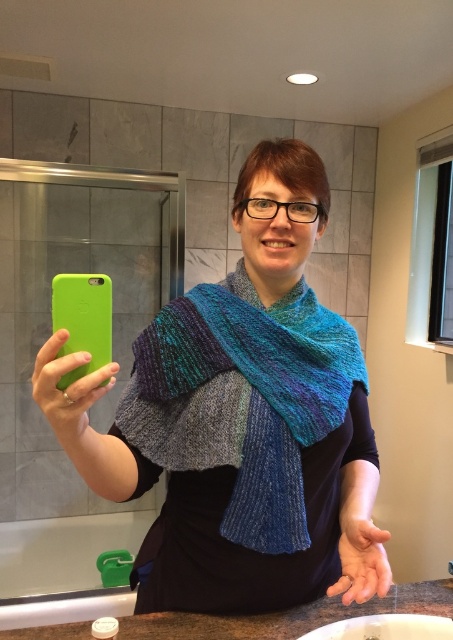
Question: Among these points, which one is farthest from the camera?

Choices:
 (A) (390, 609)
 (B) (136, 406)
 (C) (102, 326)
 (D) (73, 429)

Answer: (A)

Question: Is granite countertop at lower center wider than green matte phone at left?

Choices:
 (A) no
 (B) yes

Answer: (B)

Question: Can you confirm if knitted wool scarf at center is thinner than granite countertop at lower center?

Choices:
 (A) yes
 (B) no

Answer: (A)

Question: Is knitted wool scarf at center closer to the viewer compared to green matte phone at left?

Choices:
 (A) no
 (B) yes

Answer: (A)

Question: Which of the following is the closest to the observer?

Choices:
 (A) (14, 634)
 (B) (355, 476)
 (C) (268, 538)
 (D) (57, 378)

Answer: (D)

Question: Based on their relative distances, which object is farther from the knitted wool scarf at center?

Choices:
 (A) knitted fabric hand at center
 (B) granite countertop at lower center
 (C) green matte phone at left

Answer: (B)